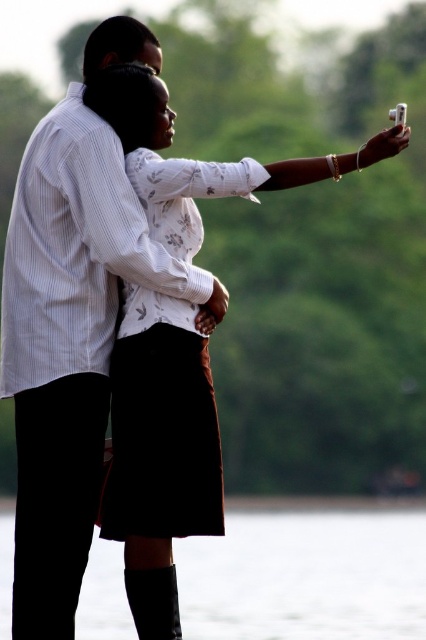
Looking at this image, measure the distance between point (106,584) and camera.

Point (106,584) is 47.08 meters away from camera.

At what (x,y) coordinates should I click in order to perform the action: click on black leather boots at lower center. Please return your answer as a coordinate pair (x, y). The height and width of the screenshot is (640, 426). Looking at the image, I should click on (305, 577).

Who is more forward, [408,616] or [170,422]?

Point [170,422] is in front.

Find the location of `black leather boots at lower center`. black leather boots at lower center is located at coordinates (305, 577).